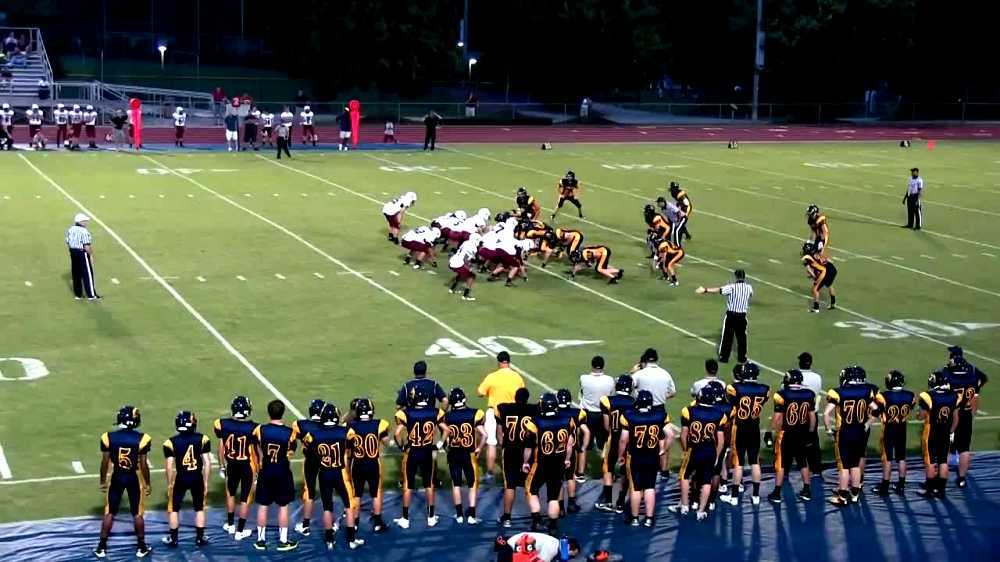
At what (x,y) coordinates should I click in order to perform the action: click on blue mat. Please return your answer as a coordinate pair (x, y). Image resolution: width=1000 pixels, height=562 pixels. Looking at the image, I should click on (731, 528).